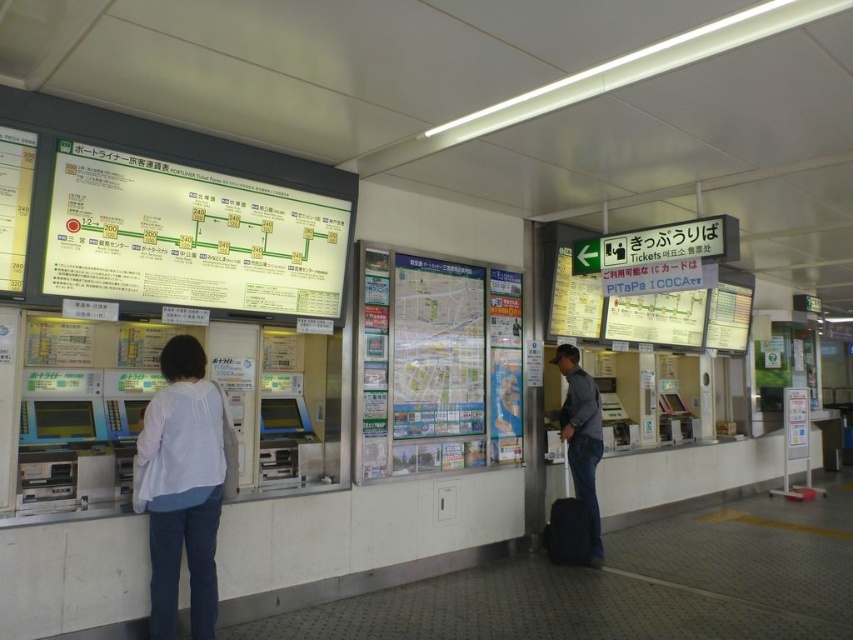
Question: Is white glossy signboard at upper left below denim jacket at center?

Choices:
 (A) yes
 (B) no

Answer: (B)

Question: Which is nearer to the black fabric suitcase at lower right?

Choices:
 (A) white matte shirt at center
 (B) denim jacket at center
 (C) white glossy signboard at upper left

Answer: (B)

Question: Which point is closer to the camera?

Choices:
 (A) (585, 563)
 (B) (598, 538)

Answer: (A)

Question: Estimate the real-world distances between objects in this image. Which object is farther from the black fabric suitcase at lower right?

Choices:
 (A) white matte shirt at center
 (B) denim jacket at center

Answer: (A)

Question: Is white glossy signboard at upper left thinner than black fabric suitcase at lower right?

Choices:
 (A) yes
 (B) no

Answer: (B)

Question: Does white glossy signboard at upper left appear on the right side of denim jacket at center?

Choices:
 (A) no
 (B) yes

Answer: (A)